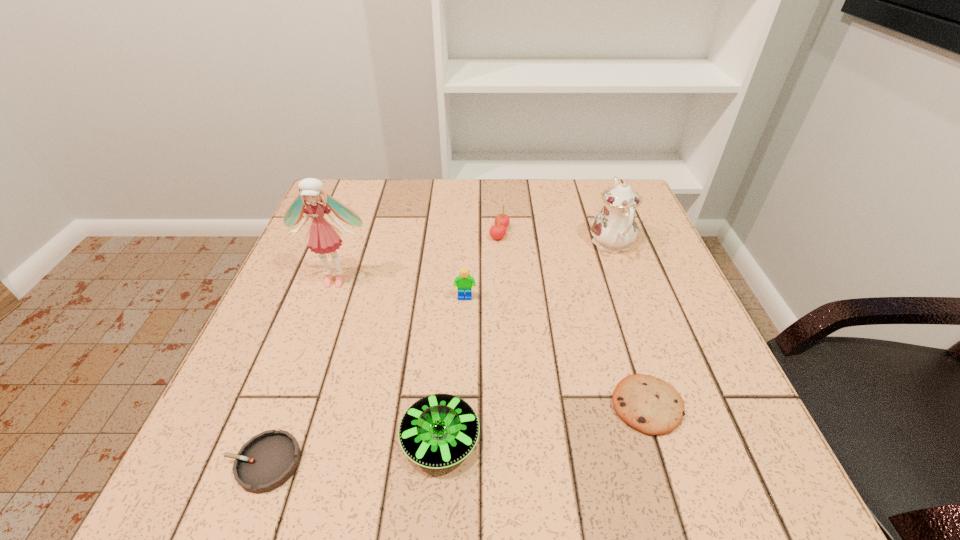
You are a GUI agent. You are given a task and a screenshot of the screen. Output one action in this format:
    pyautogui.click(x=<x>, y=<y>)
    Task: Click on the doll
    
    Given the screenshot: What is the action you would take?
    pyautogui.click(x=322, y=237)

The height and width of the screenshot is (540, 960). I want to click on the tallest object, so click(x=322, y=237).

Locate an element on the screen. This screenshot has height=540, width=960. chinaware is located at coordinates (614, 228).

Locate an element on the screen. The image size is (960, 540). Lego is located at coordinates (464, 283).

You are a GUI agent. You are given a task and a screenshot of the screen. Output one action in this format:
    pyautogui.click(x=<x>, y=<y>)
    Task: Click on the fourth farthest object
    The image size is (960, 540).
    Given the screenshot: What is the action you would take?
    pyautogui.click(x=464, y=283)

Locate an element on the screen. The width and height of the screenshot is (960, 540). cherry is located at coordinates (497, 231).

I want to click on saucer, so click(440, 430).

Where is `cookie`? cookie is located at coordinates (650, 405).

Locate an element on the screen. the shortest object is located at coordinates (265, 462).

Locate an element on the screen. vacant space situated 0.150m on the front-facing side of the fifth nearest object is located at coordinates (312, 345).